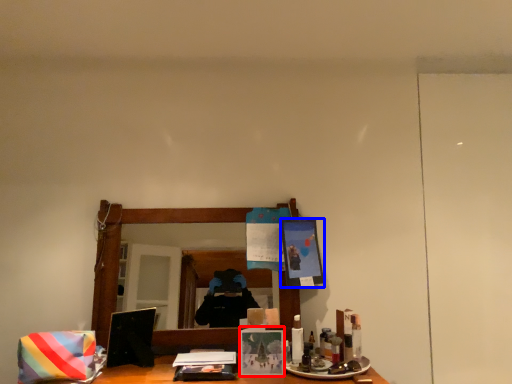
Question: Which point is further to the camera, picture frame (highlighted by a red box) or picture frame (highlighted by a blue box)?

Choices:
 (A) picture frame
 (B) picture frame

Answer: (B)